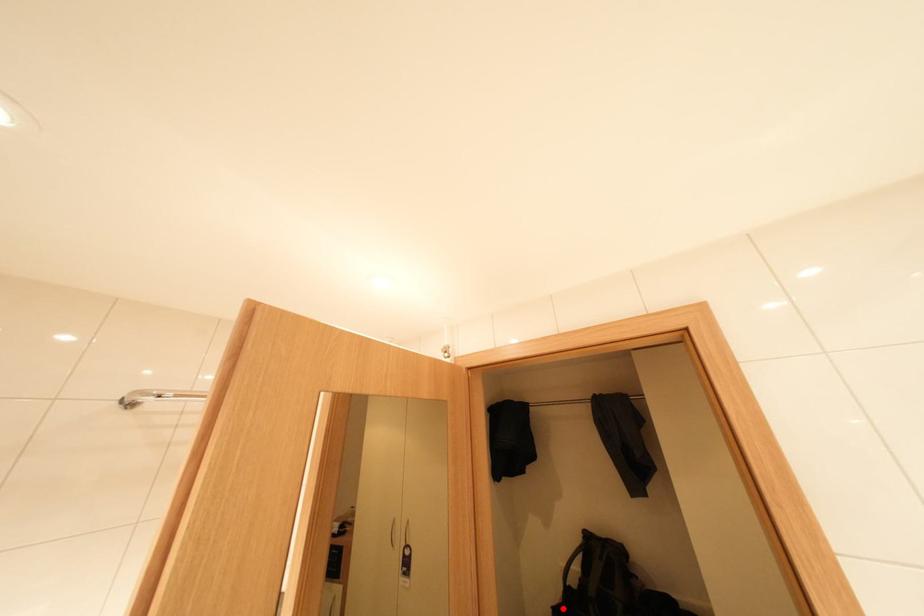
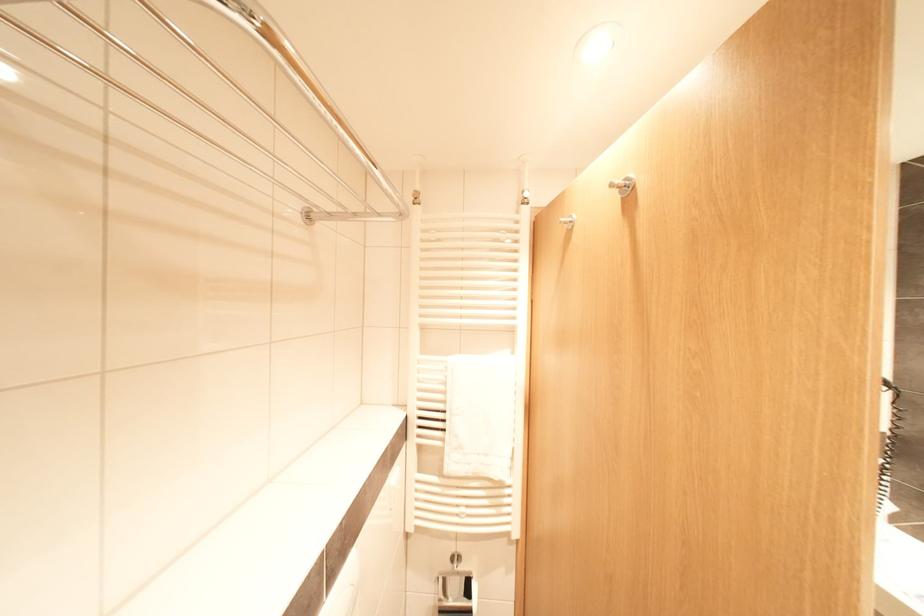
Question: I am providing you with two images of the same scene from different viewpoints. A red point is marked on the first image. At the location where the point appears in image 1, is it still visible in image 2?

Choices:
 (A) Yes
 (B) No

Answer: (B)